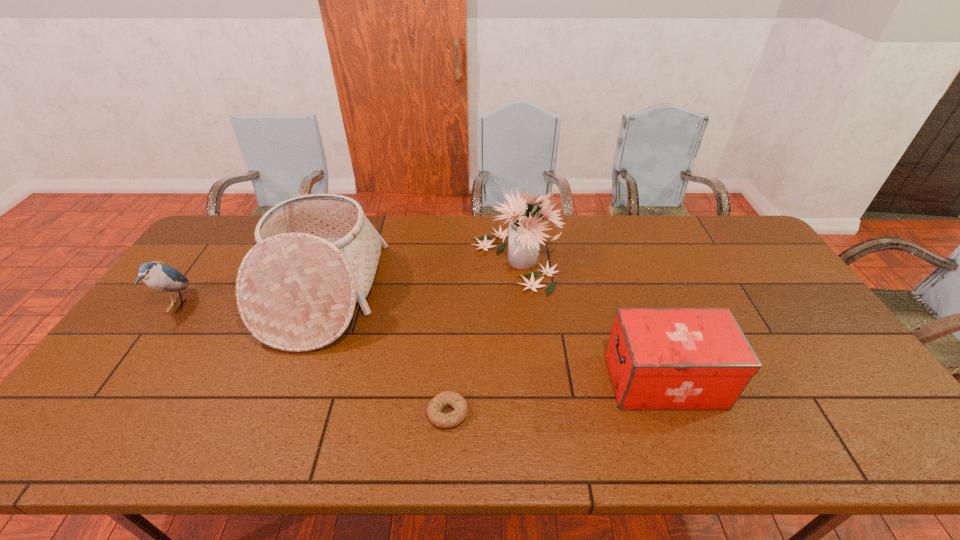
You are a GUI agent. You are given a task and a screenshot of the screen. Output one action in this format:
    pyautogui.click(x=<x>, y=<y>)
    Task: Click on the free spot at the far left corner of the desktop
    The width and height of the screenshot is (960, 540).
    Given the screenshot: What is the action you would take?
    pyautogui.click(x=224, y=248)

Locate an element on the screen. The image size is (960, 540). empty space that is in between the first-aid kit and the bird is located at coordinates (420, 343).

At what (x,y) coordinates should I click in order to perform the action: click on free space between the rightmost object and the basket. Please return your answer as a coordinate pair (x, y). This screenshot has width=960, height=540. Looking at the image, I should click on (493, 337).

You are a GUI agent. You are given a task and a screenshot of the screen. Output one action in this format:
    pyautogui.click(x=<x>, y=<y>)
    Task: Click on the free space between the rightmost object and the bouquet
    The image size is (960, 540).
    Given the screenshot: What is the action you would take?
    pyautogui.click(x=589, y=321)

Where is `free spot between the second object from left to right and the bagel`? free spot between the second object from left to right and the bagel is located at coordinates click(x=385, y=353).

Identify the location of free space between the second object from left to right and the rightmost object. The height and width of the screenshot is (540, 960). (493, 337).

Locate an element on the screen. This screenshot has height=540, width=960. vacant region between the shortest object and the bouquet is located at coordinates (481, 336).

Where is `free space between the fourth object from right to left and the first-aid kit`? The image size is (960, 540). free space between the fourth object from right to left and the first-aid kit is located at coordinates (493, 337).

Where is `blank region between the second object from left to right and the bouquet`? Image resolution: width=960 pixels, height=540 pixels. blank region between the second object from left to right and the bouquet is located at coordinates (419, 276).

Where is `blank region between the basket and the shortest object`? This screenshot has height=540, width=960. blank region between the basket and the shortest object is located at coordinates (385, 353).